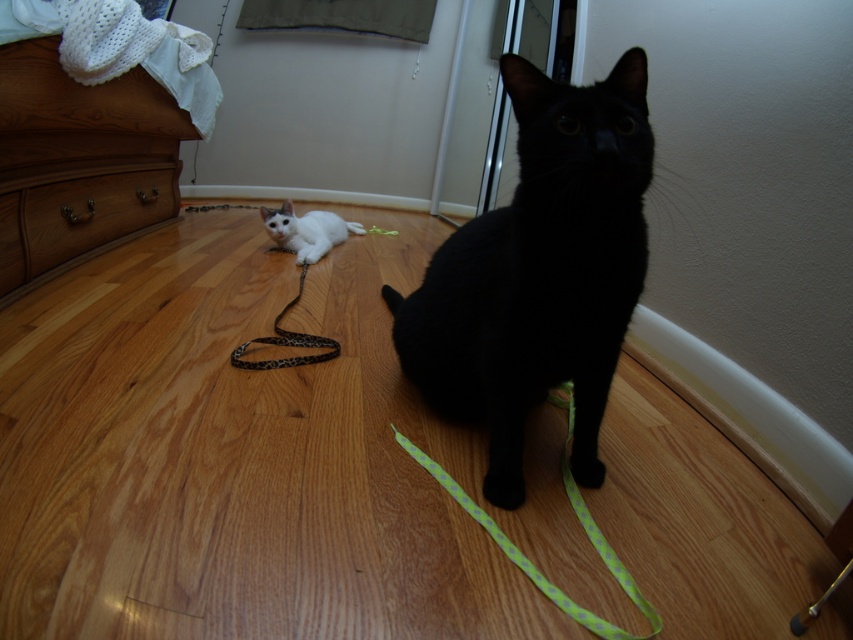
You are a pet sitter who needs to place a new cat bed in the room. The bed is designed to fit objects smaller than the brown wood drawer at left. Will the black glossy cat at center fit comfortably on the bed?

The black glossy cat at center is smaller than the brown wood drawer at left. Since the cat bed is designed for objects smaller than the drawer, the black glossy cat at center will fit comfortably on the bed.

You are standing at the point labeled as point (80,195) in the image. You want to throw a small ball to a friend who is standing 2 meters away from you. Can you reach your friend by throwing the ball directly forward?

The distance between you and your friend is exactly 2 meters, so yes, you can reach your friend by throwing the ball directly forward since the distance matches the required 2 meters.